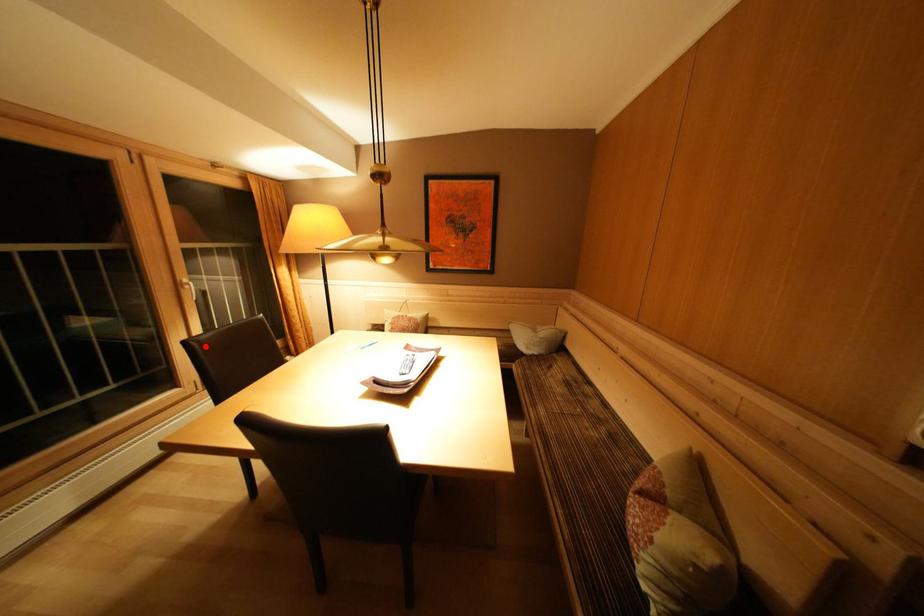
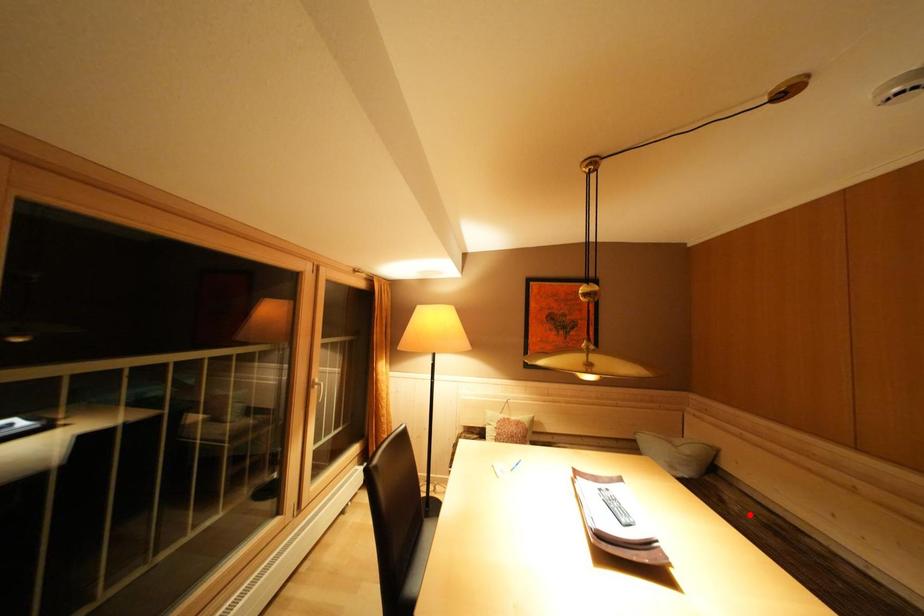
I am providing you with two images of the same scene from different viewpoints. A red point is marked on the first image and another point is marked on the second image. Is the red point in image1 aligned with the point shown in image2?

No